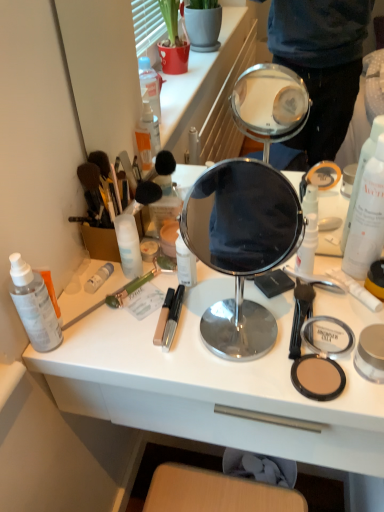
Locate an element on the screen. free space between polished silver mirror at center and translucent plastic spray bottle at left, marked as the 5th toiletry in a right-to-left arrangement is located at coordinates (129, 330).